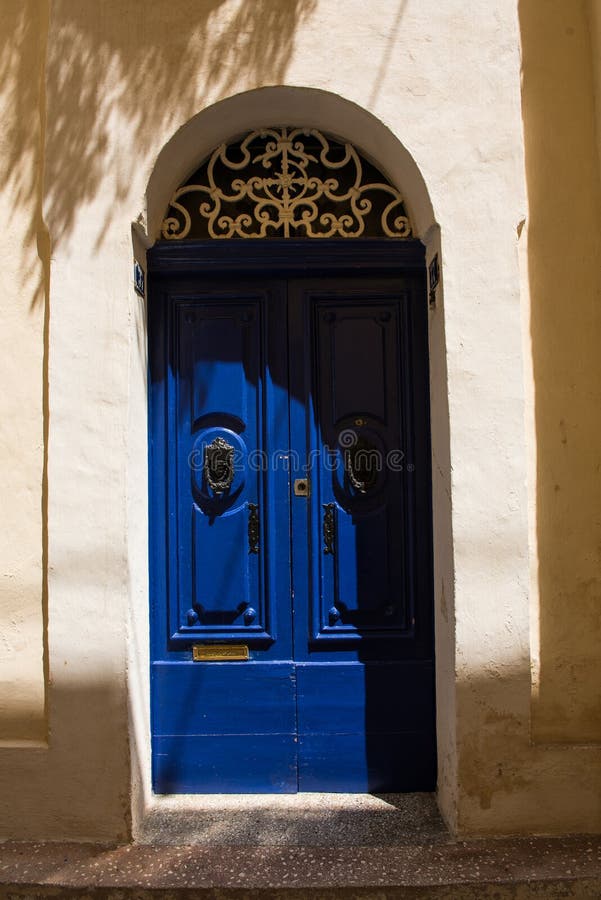
The image size is (601, 900). I want to click on left door, so click(x=270, y=543).